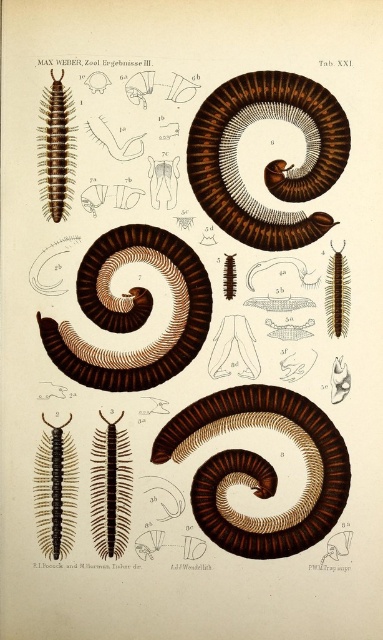
Question: Is brown matte centipede at upper center closer to camera compared to brown matte centipede at right?

Choices:
 (A) yes
 (B) no

Answer: (A)

Question: Can you confirm if brown matte centipede at upper center is positioned above brown matte centipede at left?

Choices:
 (A) yes
 (B) no

Answer: (B)

Question: Is brown matte spiral at center below brown matte centipede at left?

Choices:
 (A) yes
 (B) no

Answer: (A)

Question: Which point is farther from the camera taking this photo?

Choices:
 (A) (50, 458)
 (B) (50, 202)

Answer: (A)

Question: Among these points, which one is nearest to the camera?

Choices:
 (A) (101, 436)
 (B) (90, 369)

Answer: (A)

Question: Based on their relative distances, which object is farther from the brown matte centipede at center?

Choices:
 (A) brown matte centipede at right
 (B) brown matte centipede at left

Answer: (A)